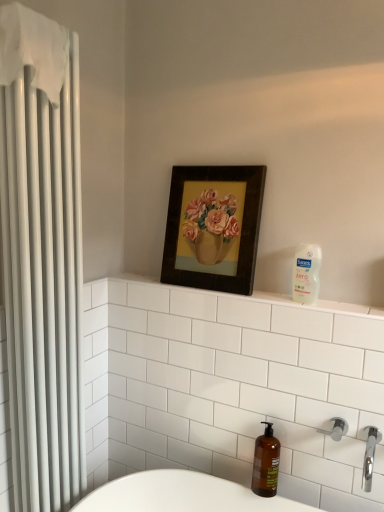
Question: From a real-world perspective, is white fabric shower curtain at left physically above satin nickel shower at lower right?

Choices:
 (A) no
 (B) yes

Answer: (B)

Question: From the image's perspective, is white fabric shower curtain at left below satin nickel shower at lower right?

Choices:
 (A) yes
 (B) no

Answer: (B)

Question: Does white fabric shower curtain at left appear on the right side of satin nickel shower at lower right?

Choices:
 (A) yes
 (B) no

Answer: (B)

Question: Is white fabric shower curtain at left at the left side of satin nickel shower at lower right?

Choices:
 (A) yes
 (B) no

Answer: (A)

Question: Considering the relative sizes of white fabric shower curtain at left and satin nickel shower at lower right in the image provided, is white fabric shower curtain at left shorter than satin nickel shower at lower right?

Choices:
 (A) no
 (B) yes

Answer: (A)

Question: Is white fabric shower curtain at left facing towards satin nickel shower at lower right?

Choices:
 (A) yes
 (B) no

Answer: (B)

Question: Does amber glass soap dispenser at lower right lie in front of wooden framed painting of flowers at upper center?

Choices:
 (A) yes
 (B) no

Answer: (A)

Question: Are amber glass soap dispenser at lower right and wooden framed painting of flowers at upper center located far from each other?

Choices:
 (A) no
 (B) yes

Answer: (A)

Question: From the image's perspective, is amber glass soap dispenser at lower right over wooden framed painting of flowers at upper center?

Choices:
 (A) yes
 (B) no

Answer: (B)

Question: From a real-world perspective, is amber glass soap dispenser at lower right positioned under wooden framed painting of flowers at upper center based on gravity?

Choices:
 (A) yes
 (B) no

Answer: (A)

Question: Considering the relative sizes of amber glass soap dispenser at lower right and wooden framed painting of flowers at upper center in the image provided, is amber glass soap dispenser at lower right bigger than wooden framed painting of flowers at upper center?

Choices:
 (A) yes
 (B) no

Answer: (B)

Question: Can you confirm if amber glass soap dispenser at lower right is positioned to the right of wooden framed painting of flowers at upper center?

Choices:
 (A) no
 (B) yes

Answer: (B)

Question: Is wooden framed painting of flowers at upper center wider than satin nickel shower at lower right?

Choices:
 (A) yes
 (B) no

Answer: (A)